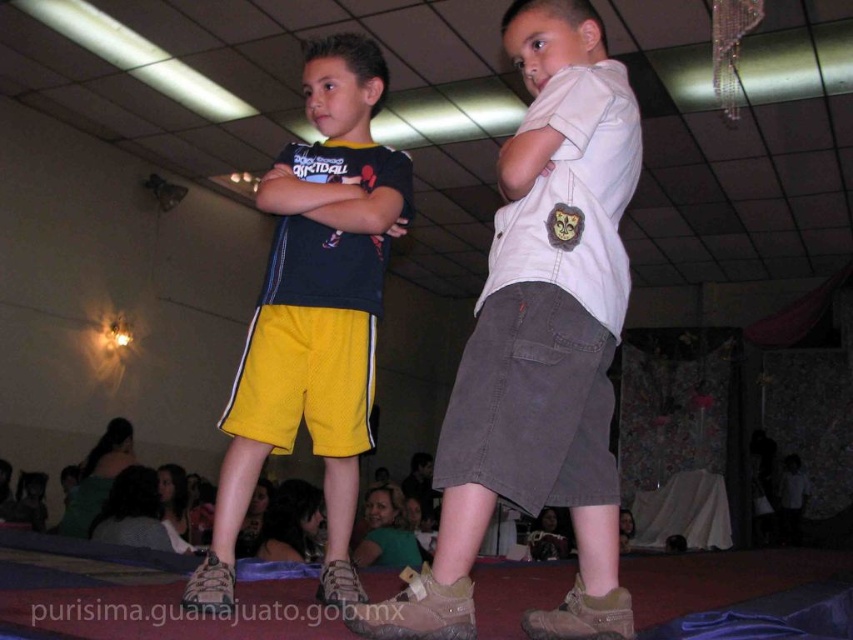
You are a photographer standing at the back of the stage. You want to take a photo of both the white matte shirt at upper center and the matte black shirt at center so that both shirts are clearly visible. Based on their current positions, can you fit both shirts into the frame without moving either of them?

The white matte shirt at upper center and the matte black shirt at center are 17.51 inches apart. Since the distance between them is known, you can adjust your camera angle or zoom to ensure both shirts are within the frame without needing to move them.

You are a stagehand setting up a spotlight for the performance. The spotlight needs to be positioned at the point marked by coordinates point (538, 340). Which object in the scene will be illuminated by this spotlight?

The point (538, 340) marks matte yellow shorts at center, so the spotlight will illuminate the matte yellow shorts at center.